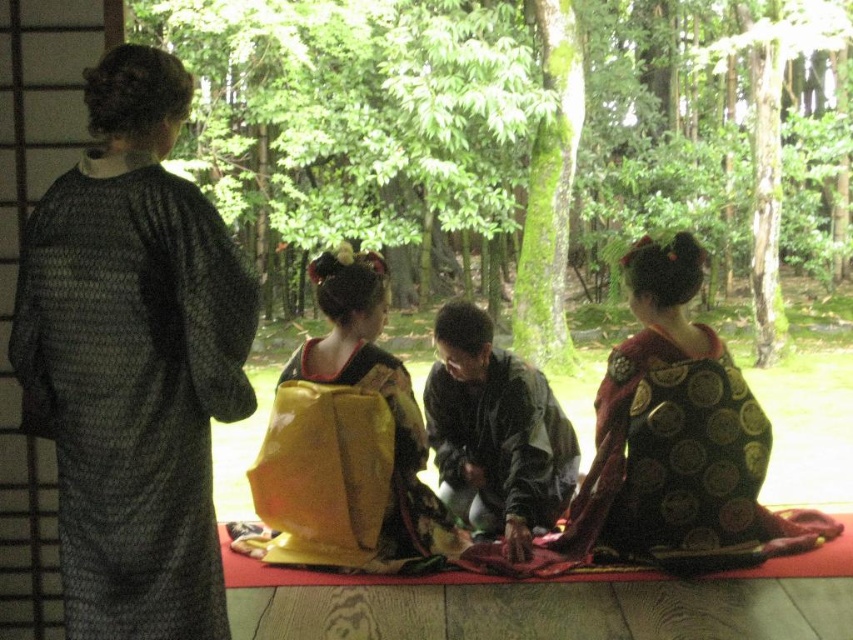
You are a photographer planning to take a photo of the black silk kimono at center and the yellow satin kimono at center. Since both are at the center, how are they arranged spatially?

The black silk kimono at center is positioned over the yellow satin kimono at center, so the black one is layered on top of the yellow one in the photo.

You are organizing a cultural event and need to ensure there is enough space for participants. Given the yellow satin kimono at center and the dark green fabric at center, which one requires more horizontal space due to its width?

The yellow satin kimono at center might require more horizontal space than the dark green fabric at center since it is wider.